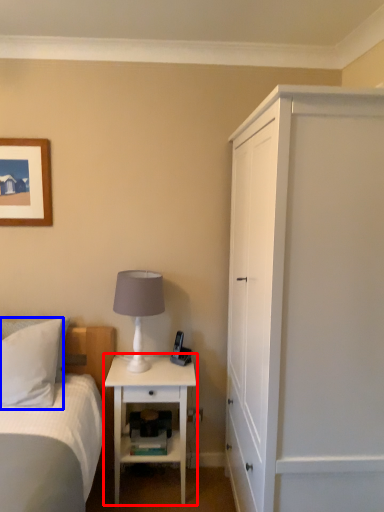
Question: Among these objects, which one is farthest to the camera, nightstand (highlighted by a red box) or pillow (highlighted by a blue box)?

Choices:
 (A) nightstand
 (B) pillow

Answer: (A)